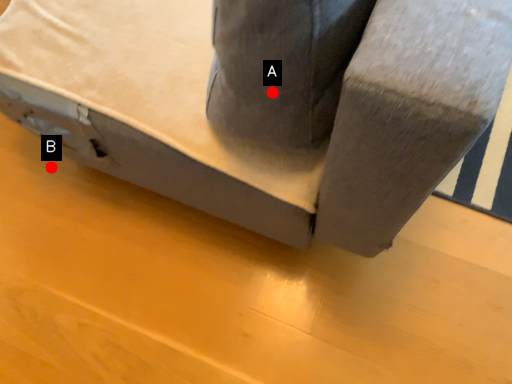
Question: Two points are circled on the image, labeled by A and B beside each circle. Which point is closer to the camera?

Choices:
 (A) A is closer
 (B) B is closer

Answer: (A)